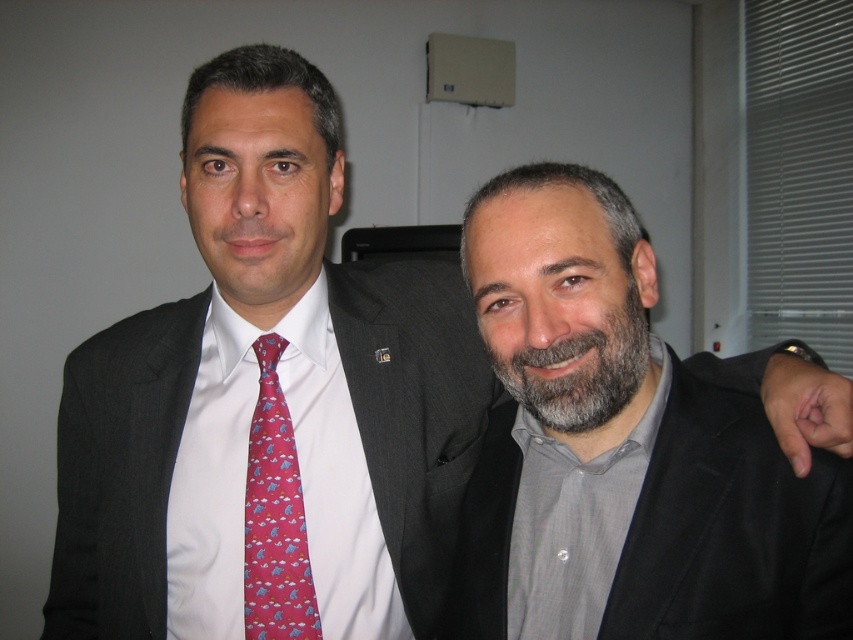
Question: Which object appears farthest from the camera in this image?

Choices:
 (A) pink silk tie at left
 (B) gray matte suit at right
 (C) grayhairbeard at center

Answer: (A)

Question: Which object appears closest to the camera in this image?

Choices:
 (A) gray matte suit at right
 (B) pink silk tie at left

Answer: (A)

Question: Does gray matte suit at right come in front of pink silk tie at left?

Choices:
 (A) yes
 (B) no

Answer: (A)

Question: In this image, where is pink silk tie at left located relative to grayhairbeard at center?

Choices:
 (A) below
 (B) above

Answer: (A)

Question: Estimate the real-world distances between objects in this image. Which object is farther from the grayhairbeard at center?

Choices:
 (A) pink silk tie at left
 (B) gray matte suit at right

Answer: (A)

Question: Does pink silk tie at left lie in front of grayhairbeard at center?

Choices:
 (A) no
 (B) yes

Answer: (A)